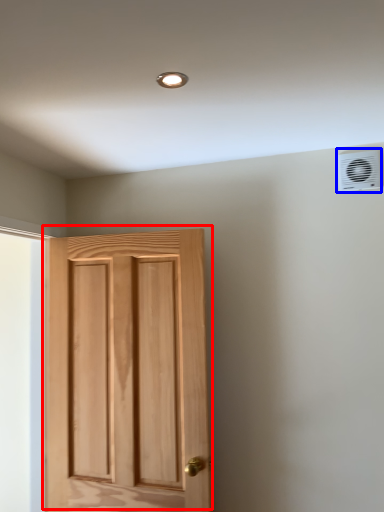
Question: Which object appears closest to the camera in this image, door (highlighted by a red box) or air conditioning (highlighted by a blue box)?

Choices:
 (A) door
 (B) air conditioning

Answer: (A)